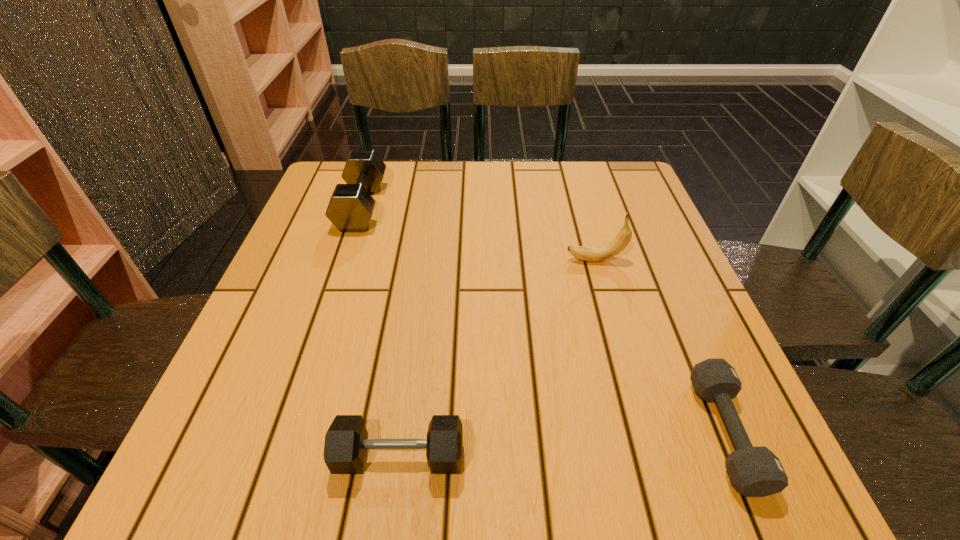
Where is `vacant space that satisfies the following two spatial constraints: 1. at the start of the peel on the rightmost object; 2. on the right side of the third object from left to right`? This screenshot has height=540, width=960. vacant space that satisfies the following two spatial constraints: 1. at the start of the peel on the rightmost object; 2. on the right side of the third object from left to right is located at coordinates (644, 433).

Locate an element on the screen. blank area in the image that satisfies the following two spatial constraints: 1. on the back side of the rightmost object; 2. at the start of the peel on the banana is located at coordinates 653,260.

Where is `free space that satisfies the following two spatial constraints: 1. on the back side of the shortest object; 2. at the start of the peel on the tallest object`? free space that satisfies the following two spatial constraints: 1. on the back side of the shortest object; 2. at the start of the peel on the tallest object is located at coordinates (653, 260).

I want to click on vacant position in the image that satisfies the following two spatial constraints: 1. on the front side of the tallest dumbbell; 2. on the left side of the rightmost object, so click(286, 433).